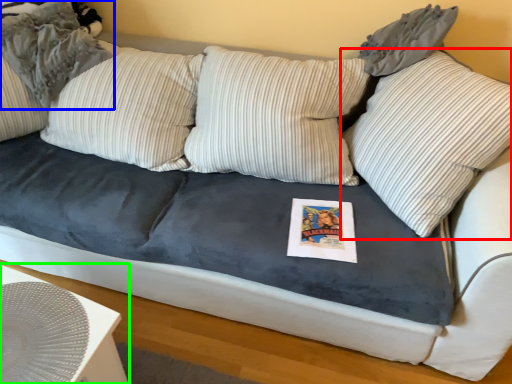
Question: Considering the real-world distances, which object is farthest from pillow (highlighted by a red box)? pillow (highlighted by a blue box) or table (highlighted by a green box)?

Choices:
 (A) pillow
 (B) table

Answer: (A)